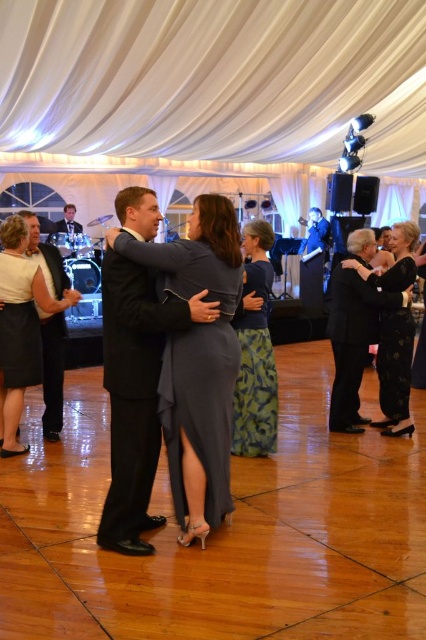
Does black satin suit at center appear over black satin dress at lower left?

Incorrect, black satin suit at center is not positioned above black satin dress at lower left.

Is point (149, 300) positioned behind point (14, 364)?

No, it is in front of (14, 364).

At what (x,y) coordinates should I click in order to perform the action: click on black satin suit at center. Please return your answer as a coordinate pair (x, y). This screenshot has height=640, width=426. Looking at the image, I should click on (135, 392).

Between matte white dress at left and black floral dress at right, which one has less height?

black floral dress at right is shorter.

Is matte white dress at left to the left of black floral dress at right from the viewer's perspective?

Indeed, matte white dress at left is positioned on the left side of black floral dress at right.

Which is behind, point (25, 371) or point (391, 340)?

The point (391, 340) is behind.

Where is `matte white dress at left`? The height and width of the screenshot is (640, 426). matte white dress at left is located at coordinates (20, 326).

Can you confirm if black satin dress at right is shorter than black floral dress at right?

No, black satin dress at right is not shorter than black floral dress at right.

How distant is black satin dress at right from black floral dress at right?

They are 1.72 inches apart.

The image size is (426, 640). I want to click on black satin dress at right, so click(394, 371).